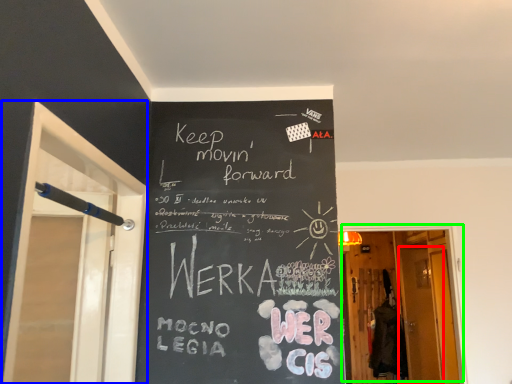
Question: Based on their relative distances, which object is farther from screen door (highlighted by a red box)? Choose from screen door (highlighted by a blue box) and door (highlighted by a green box).

Choices:
 (A) screen door
 (B) door

Answer: (A)